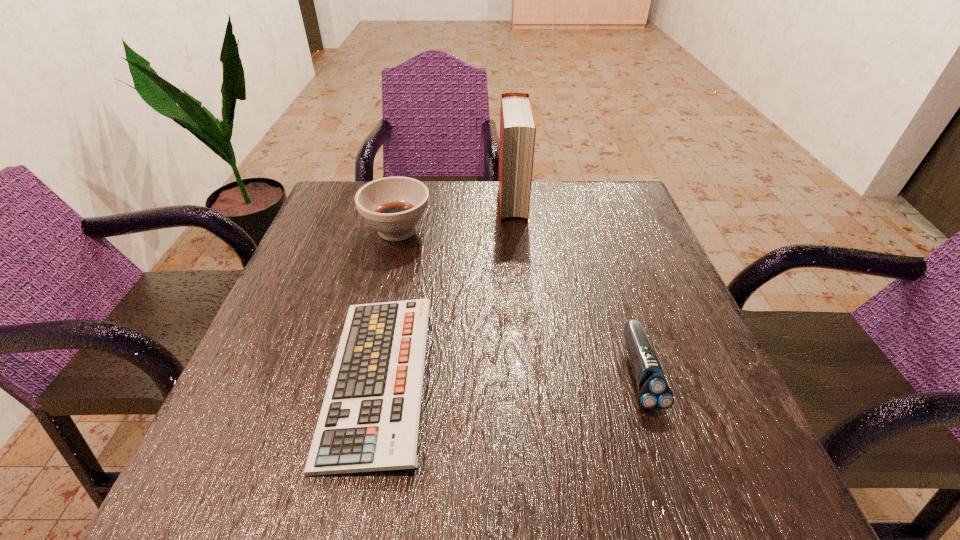
The image size is (960, 540). Identify the location of vacant space at the left edge of the desktop. (293, 414).

Locate an element on the screen. free location at the right edge is located at coordinates coord(669,382).

Locate an element on the screen. This screenshot has width=960, height=540. vacant space at the near left corner of the desktop is located at coordinates (194, 501).

In the image, there is a desktop. Where is `free space at the far right corner`? The image size is (960, 540). free space at the far right corner is located at coordinates (623, 202).

You are a GUI agent. You are given a task and a screenshot of the screen. Output one action in this format:
    pyautogui.click(x=<x>, y=<y>)
    Task: Click on the free spot between the third tallest object and the computer keyboard
    The width and height of the screenshot is (960, 540).
    Given the screenshot: What is the action you would take?
    pyautogui.click(x=509, y=375)

Locate an element on the screen. vacant area that lies between the tallest object and the electric shaver is located at coordinates (576, 287).

What are the coordinates of `empty location between the hardback book and the soup bowl` in the screenshot? It's located at (455, 216).

The image size is (960, 540). Find the location of `vacant area that lies between the tallest object and the soup bowl`. vacant area that lies between the tallest object and the soup bowl is located at coordinates (455, 216).

Find the location of a particular element. The image size is (960, 540). free area in between the second object from right to left and the rightmost object is located at coordinates (576, 287).

Locate an element on the screen. vacant point located between the second object from right to left and the soup bowl is located at coordinates (455, 216).